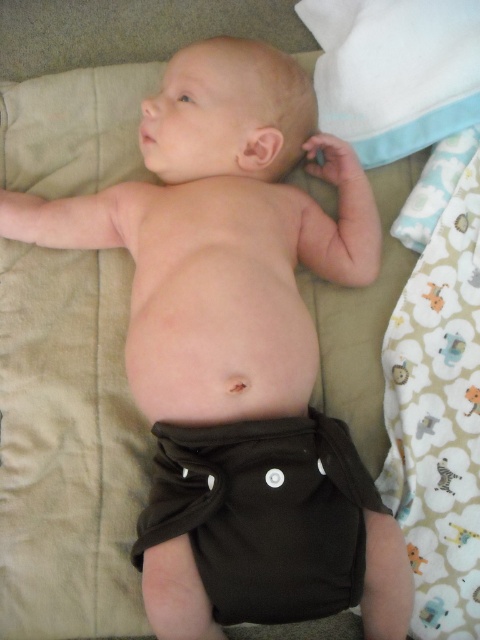
Is brown fabric diaper at center positioned behind white fabric at lower right?

No, brown fabric diaper at center is in front of white fabric at lower right.

Does brown fabric diaper at center have a lesser width compared to white fabric at lower right?

Incorrect, brown fabric diaper at center's width is not less than white fabric at lower right's.

The width and height of the screenshot is (480, 640). Describe the element at coordinates (264, 515) in the screenshot. I see `brown fabric diaper at center` at that location.

The height and width of the screenshot is (640, 480). Identify the location of brown fabric diaper at center. (264, 515).